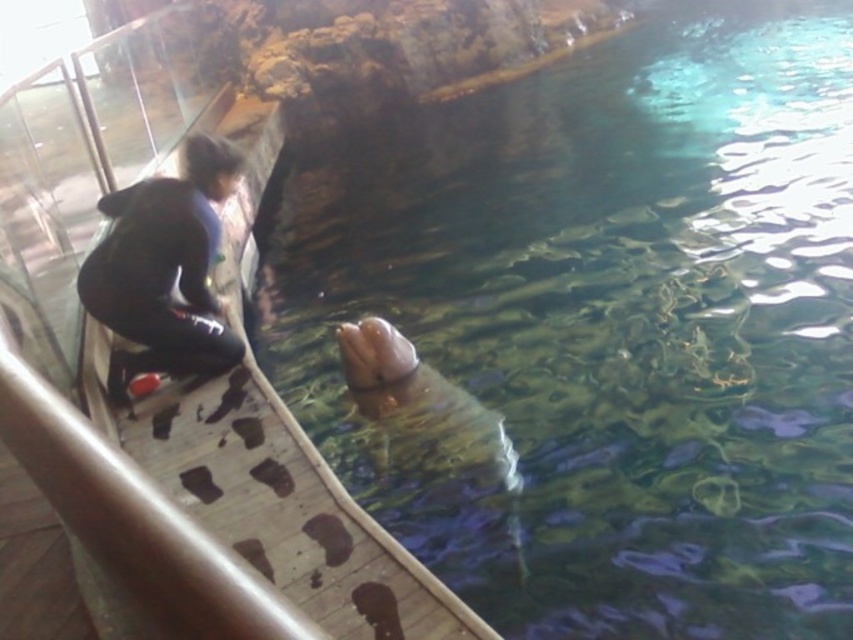
You are a visitor at the aquarium and want to take a photo of the seal. The seal is currently above the clear water at seal upper. To avoid blocking the seal in the photo, should you move the black matte jacket at left closer to or farther away from the seal?

The clear water at seal upper is taller than the black matte jacket at left. Since the water is taller, moving the black matte jacket at left closer to the seal would place it behind the water, potentially blocking the seal. To avoid blocking, move it farther away so it stays in front but doesn not obstruct the view.

Consider the image. You are a visitor at the aquarium and want to take a photo of the seal. You notice the clear water at seal upper and the black matte jacket at left in your frame. Which object takes up more horizontal space in the photo?

The clear water at seal upper takes up more horizontal space than the black matte jacket at left because its width surpasses the jacket.